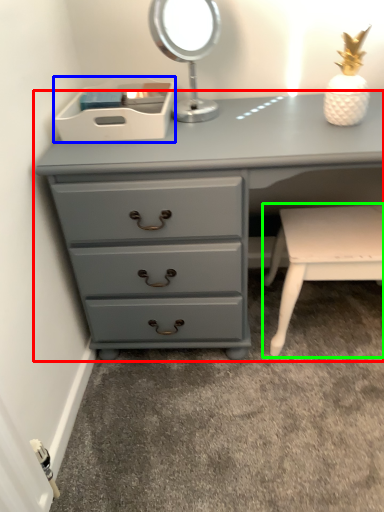
Question: Which is nearer to the chest of drawers (highlighted by a red box)? storage box (highlighted by a blue box) or table (highlighted by a green box).

Choices:
 (A) storage box
 (B) table

Answer: (A)